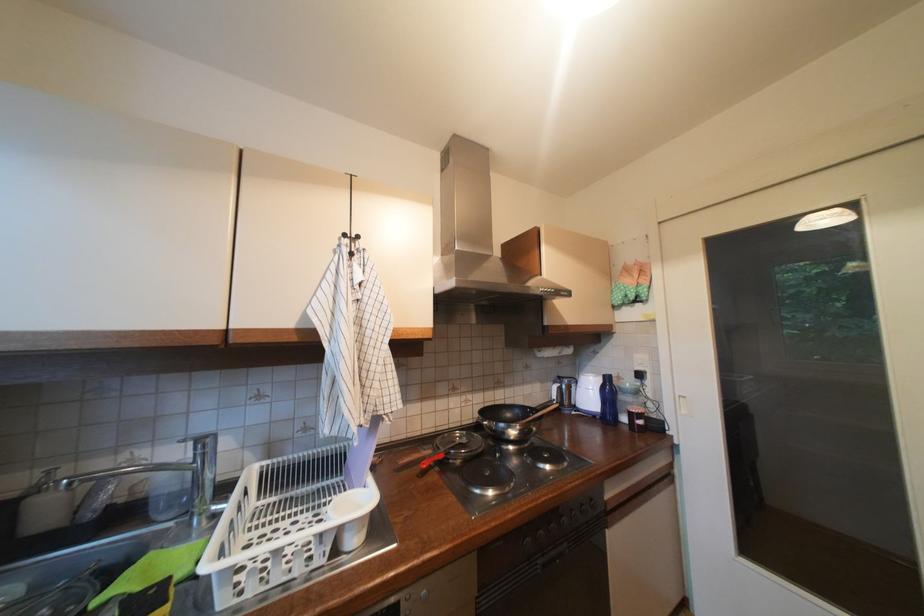
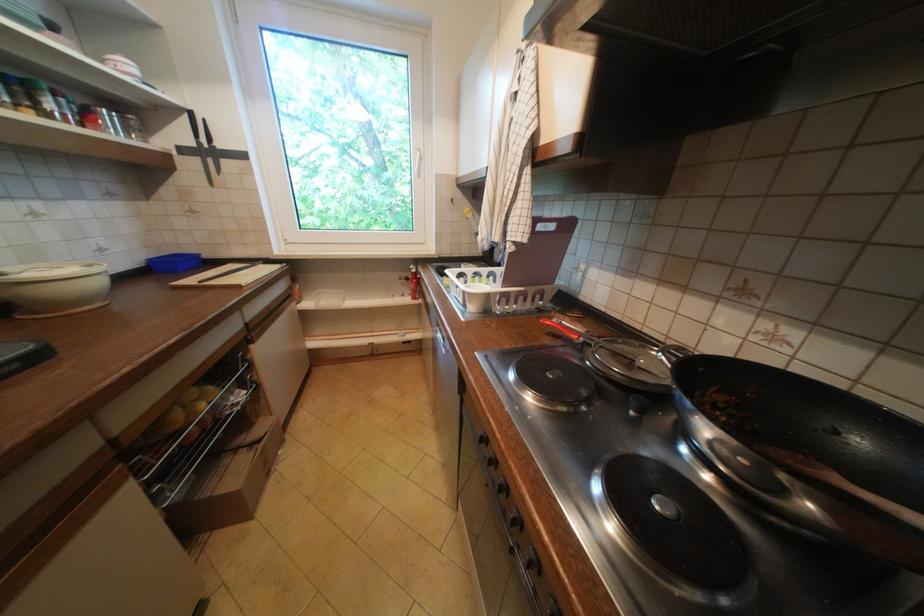
Question: I am providing you with two images of the same scene from different viewpoints. After the viewpoint changes to image2, which objects are now occluded?

Choices:
 (A) yellow fruit
 (B) black handle knife
 (C) blue plastic container
 (D) none of these

Answer: (D)